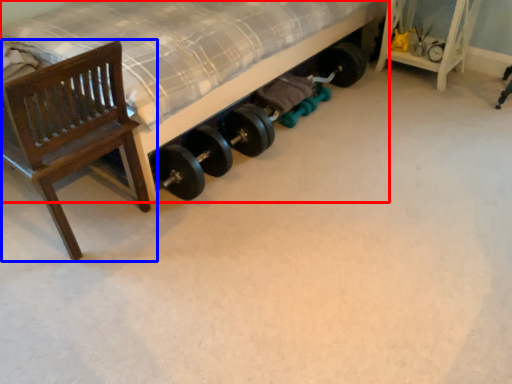
Question: Which object is further to the camera taking this photo, bed (highlighted by a red box) or chair (highlighted by a blue box)?

Choices:
 (A) bed
 (B) chair

Answer: (A)